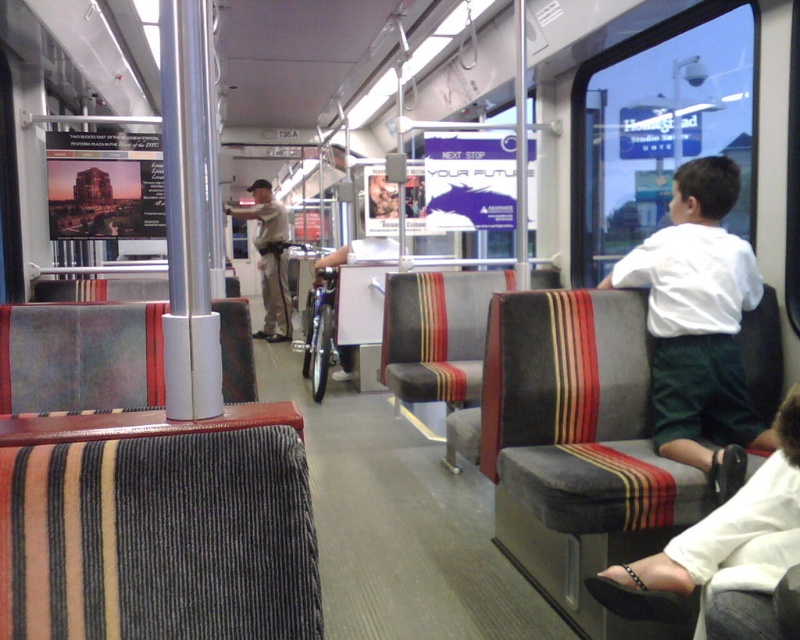
Between white cotton shirt at right and khaki uniform at center, which one appears on the left side from the viewer's perspective?

khaki uniform at center

Which is in front, point (678, 323) or point (256, 189)?

Point (678, 323)

Does point (688, 250) lie in front of point (266, 227)?

That is True.

I want to click on white cotton shirt at right, so click(x=698, y=324).

Is white fabric shoe at lower right smaller than khaki uniform at center?

Correct, white fabric shoe at lower right occupies less space than khaki uniform at center.

Is white fabric shoe at lower right bigger than khaki uniform at center?

No, white fabric shoe at lower right is not bigger than khaki uniform at center.

The height and width of the screenshot is (640, 800). In order to click on white fabric shoe at lower right in this screenshot , I will do `click(724, 552)`.

Looking at this image, how distant is white cotton shirt at right from white fabric shoe at lower right?

white cotton shirt at right and white fabric shoe at lower right are 23.95 inches apart.

Can you confirm if white cotton shirt at right is positioned to the left of white fabric shoe at lower right?

In fact, white cotton shirt at right is to the right of white fabric shoe at lower right.

This screenshot has height=640, width=800. Describe the element at coordinates (698, 324) in the screenshot. I see `white cotton shirt at right` at that location.

Locate an element on the screen. white cotton shirt at right is located at coordinates (698, 324).